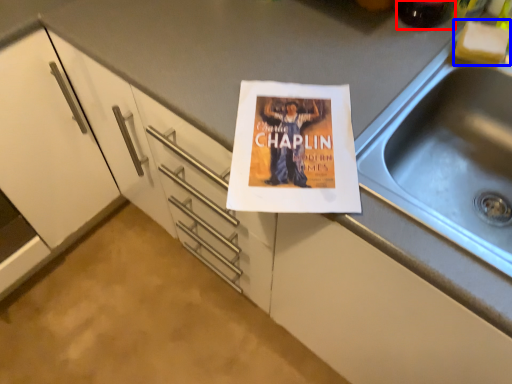
Question: Among these objects, which one is farthest to the camera, beverage (highlighted by a red box) or food (highlighted by a blue box)?

Choices:
 (A) beverage
 (B) food

Answer: (B)